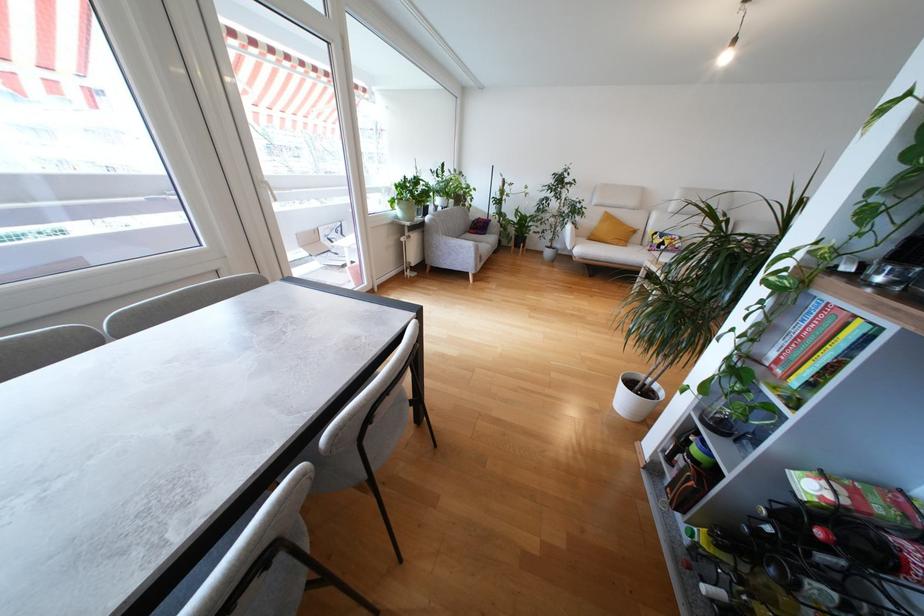
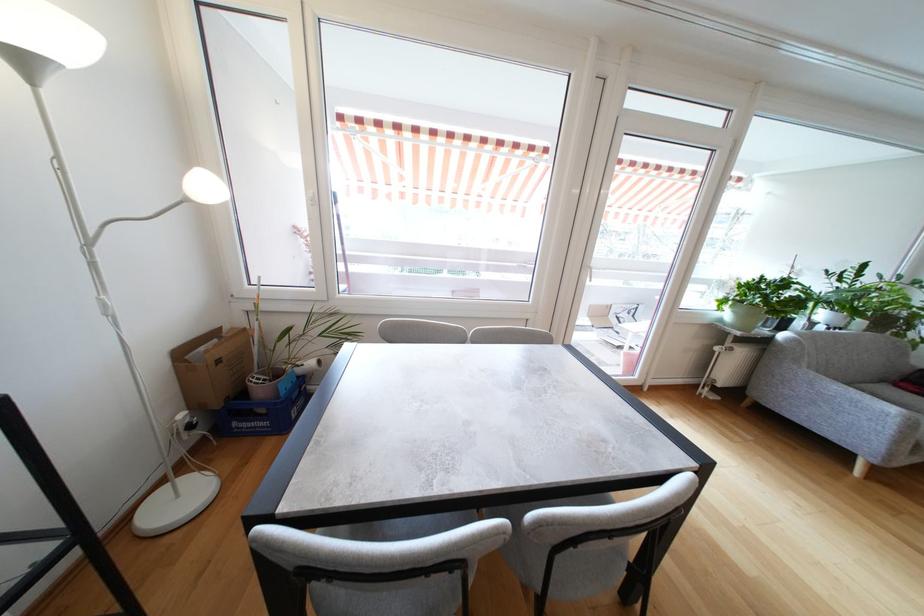
Find the pixel in the second image that matches (446,209) in the first image.

(833, 330)